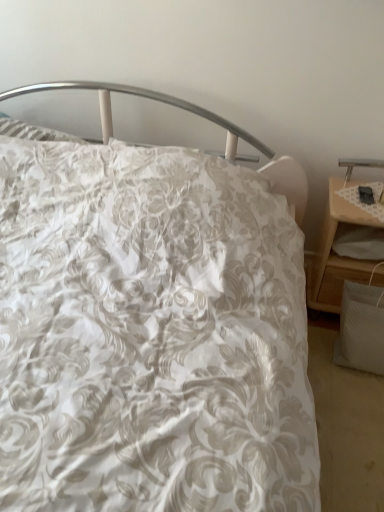
Question: Is metallic silver table lamp at right placed right next to wooden nightstand at right?

Choices:
 (A) yes
 (B) no

Answer: (B)

Question: From the image's perspective, does metallic silver table lamp at right appear higher than wooden nightstand at right?

Choices:
 (A) no
 (B) yes

Answer: (B)

Question: Does metallic silver table lamp at right have a lesser width compared to wooden nightstand at right?

Choices:
 (A) yes
 (B) no

Answer: (A)

Question: Considering the relative sizes of metallic silver table lamp at right and wooden nightstand at right in the image provided, is metallic silver table lamp at right smaller than wooden nightstand at right?

Choices:
 (A) no
 (B) yes

Answer: (B)

Question: Considering the relative positions of metallic silver table lamp at right and wooden nightstand at right in the image provided, is metallic silver table lamp at right to the right of wooden nightstand at right from the viewer's perspective?

Choices:
 (A) yes
 (B) no

Answer: (A)

Question: Does metallic silver table lamp at right appear on the left side of wooden nightstand at right?

Choices:
 (A) no
 (B) yes

Answer: (A)

Question: Considering the relative sizes of wooden nightstand at right and metallic silver table lamp at right in the image provided, is wooden nightstand at right wider than metallic silver table lamp at right?

Choices:
 (A) no
 (B) yes

Answer: (B)

Question: Is wooden nightstand at right to the right of metallic silver table lamp at right from the viewer's perspective?

Choices:
 (A) yes
 (B) no

Answer: (B)

Question: Does wooden nightstand at right have a greater height compared to metallic silver table lamp at right?

Choices:
 (A) no
 (B) yes

Answer: (B)

Question: Considering the relative sizes of wooden nightstand at right and metallic silver table lamp at right in the image provided, is wooden nightstand at right thinner than metallic silver table lamp at right?

Choices:
 (A) no
 (B) yes

Answer: (A)

Question: Is wooden nightstand at right oriented away from metallic silver table lamp at right?

Choices:
 (A) yes
 (B) no

Answer: (B)

Question: Considering the relative sizes of wooden nightstand at right and metallic silver table lamp at right in the image provided, is wooden nightstand at right shorter than metallic silver table lamp at right?

Choices:
 (A) no
 (B) yes

Answer: (A)

Question: Looking at their shapes, would you say metallic silver table lamp at right is wider or thinner than wooden nightstand at right?

Choices:
 (A) thin
 (B) wide

Answer: (A)